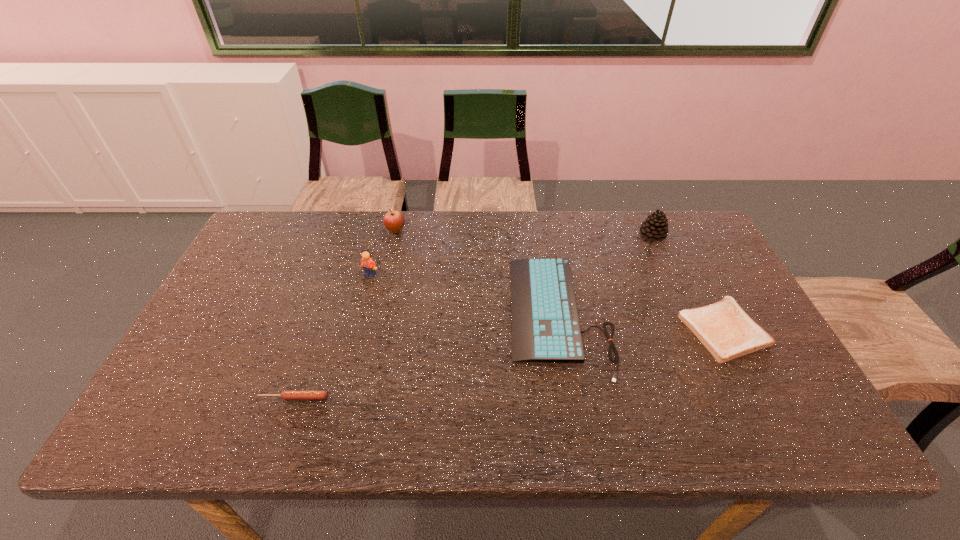
The width and height of the screenshot is (960, 540). In order to click on free space located 0.210m at the narrow end of the pinecone in this screenshot , I will do `click(575, 235)`.

The width and height of the screenshot is (960, 540). I want to click on vacant space situated 0.280m on the right of the apple, so click(491, 231).

This screenshot has height=540, width=960. I want to click on vacant space located 0.120m on the front-facing side of the Lego, so click(362, 308).

Where is `vacant space located 0.240m on the right of the computer keyboard`? This screenshot has height=540, width=960. vacant space located 0.240m on the right of the computer keyboard is located at coordinates (700, 315).

Locate an element on the screen. vacant region located on the right of the sausage is located at coordinates (471, 397).

Where is `free spot located on the left of the toast`? free spot located on the left of the toast is located at coordinates (554, 329).

At what (x,y) coordinates should I click in order to perform the action: click on pinecone that is positioned at the far edge. Please return your answer as a coordinate pair (x, y). Image resolution: width=960 pixels, height=540 pixels. Looking at the image, I should click on (655, 227).

Identify the location of apple that is at the far edge. The image size is (960, 540). pos(394,221).

Find the location of a particular element. Image resolution: width=960 pixels, height=540 pixels. pinecone located at the right edge is located at coordinates (655, 227).

You are a GUI agent. You are given a task and a screenshot of the screen. Output one action in this format:
    pyautogui.click(x=<x>, y=<y>)
    Task: Click on the toast situated at the right edge
    This screenshot has width=960, height=540.
    Given the screenshot: What is the action you would take?
    pyautogui.click(x=724, y=328)